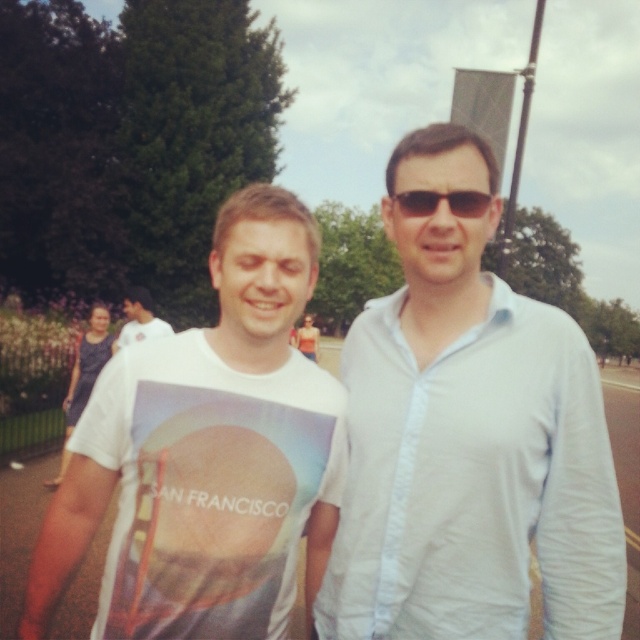
You are a photographer trying to capture a photo of the white cotton shirt at center. Based on its position in the image, which direction should you move the camera to center it in the frame?

The white cotton shirt at center is already centered in the frame since its coordinates are at point (474, 483), which is near the center of the image.

You are standing in the park and see two points marked in the image. Which point, point (422, 198) or point (120, 340), is nearer to you?

Point (422, 198) is closer to the viewer than point (120, 340).